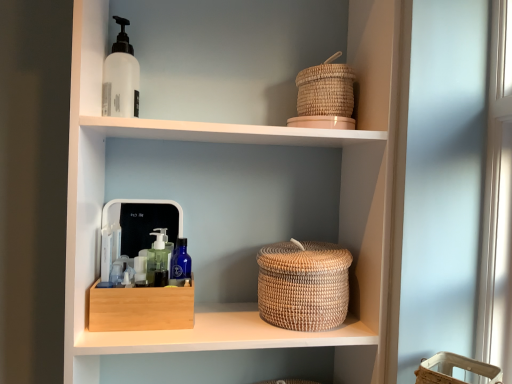
Question: Is natural woven basket at upper right wider or thinner than woven natural basket at upper right, the 1th basket when ordered from back to front?

Choices:
 (A) wide
 (B) thin

Answer: (A)

Question: Considering their positions, is natural woven basket at upper right located in front of or behind woven natural basket at upper right, placed as the 1th basket when sorted from top to bottom?

Choices:
 (A) behind
 (B) front

Answer: (B)

Question: Which is farther from the woven natural basket at upper right, acting as the first basket starting from the left?

Choices:
 (A) bamboo box at center
 (B) woven beige basket at lower right, the 2th basket positioned from the left
 (C) natural woven basket at upper right
 (D) white matte bottle at upper left
 (E) woven natural basket at center

Answer: (B)

Question: Estimate the real-world distances between objects in this image. Which object is farther from the natural woven basket at upper right?

Choices:
 (A) woven natural basket at center
 (B) bamboo box at center
 (C) woven beige basket at lower right, the 2th basket when ordered from top to bottom
 (D) woven natural basket at upper right, positioned as the second basket in front-to-back order
 (E) white matte bottle at upper left

Answer: (C)